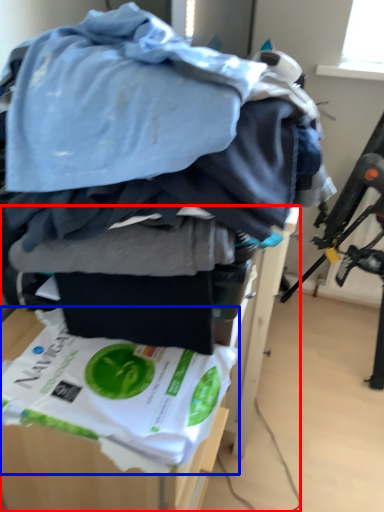
Question: Among these objects, which one is farthest to the camera, furniture (highlighted by a red box) or waste (highlighted by a blue box)?

Choices:
 (A) furniture
 (B) waste

Answer: (A)